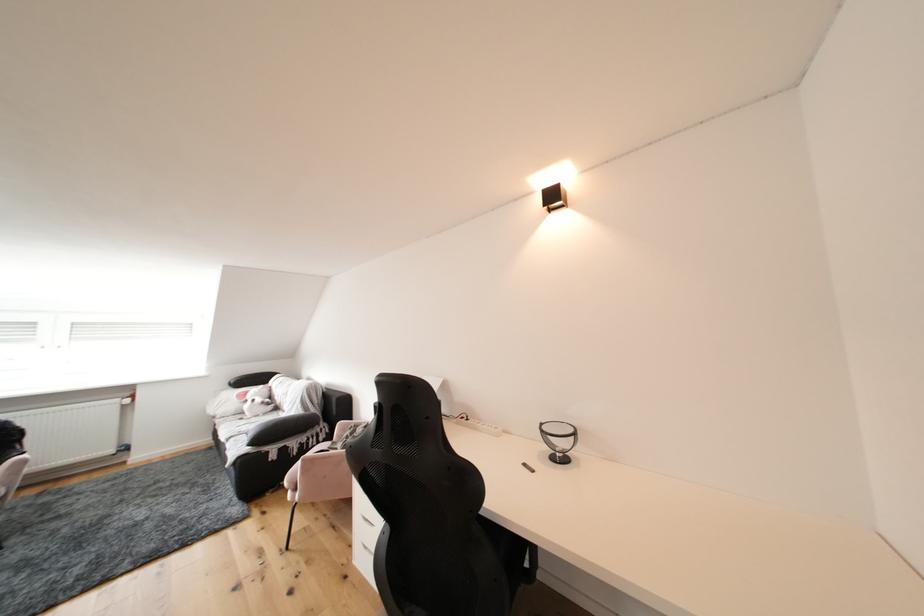
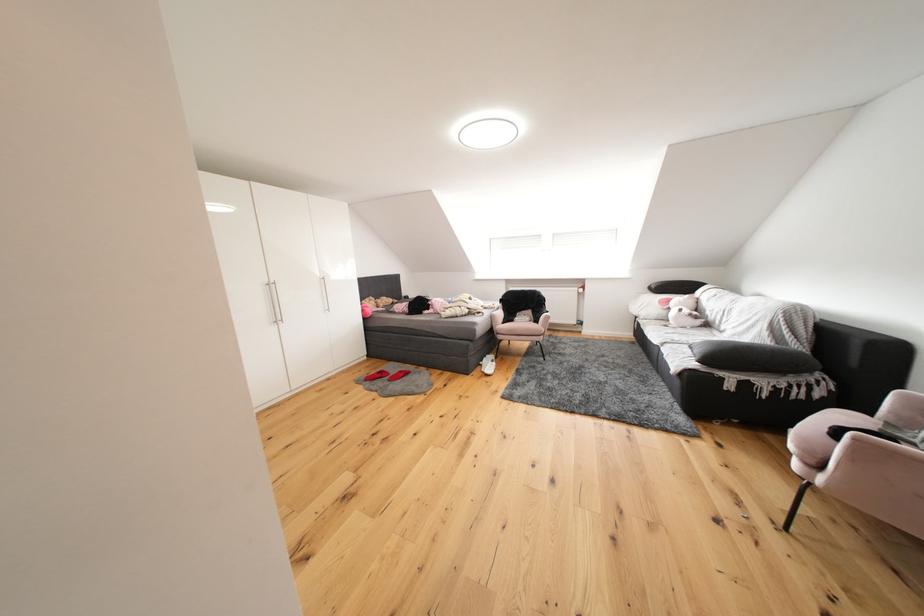
Locate, in the second image, the point that corresponds to point (237, 418) in the first image.

(660, 321)